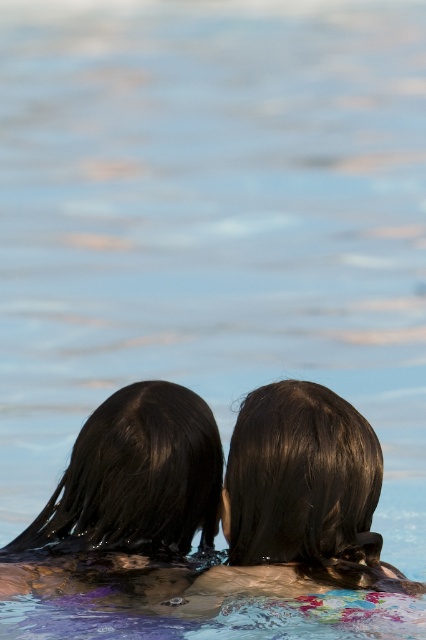
You are a photographer trying to capture a closeup shot of both the shiny dark hair at center and the wet dark brown hair at center. Given that your camera lens has a minimum focusing distance of 12 inches, will you be able to take the photo without moving closer?

The distance between the shiny dark hair at center and the wet dark brown hair at center is 10.55 inches, which is less than the camera lens minimum focusing distance of 12 inches. Therefore, you can take the photo without moving closer.

You are a photographer trying to capture the perfect shot of the two individuals in the water. You want to focus on the point closer to you between point (244,432) and point (123,483). Which point should you aim your camera at?

Point (244,432) is closer to the viewer than point (123,483), so you should aim your camera at point (244,432) to focus on the closer point.

You are a photographer capturing the scene from above the water. You notice two strands of hair, the shiny dark hair at center and the wet dark brown hair at center. Which strand is closer to the water surface?

The shiny dark hair at center is closer to the water surface because it is positioned above the wet dark brown hair at center.